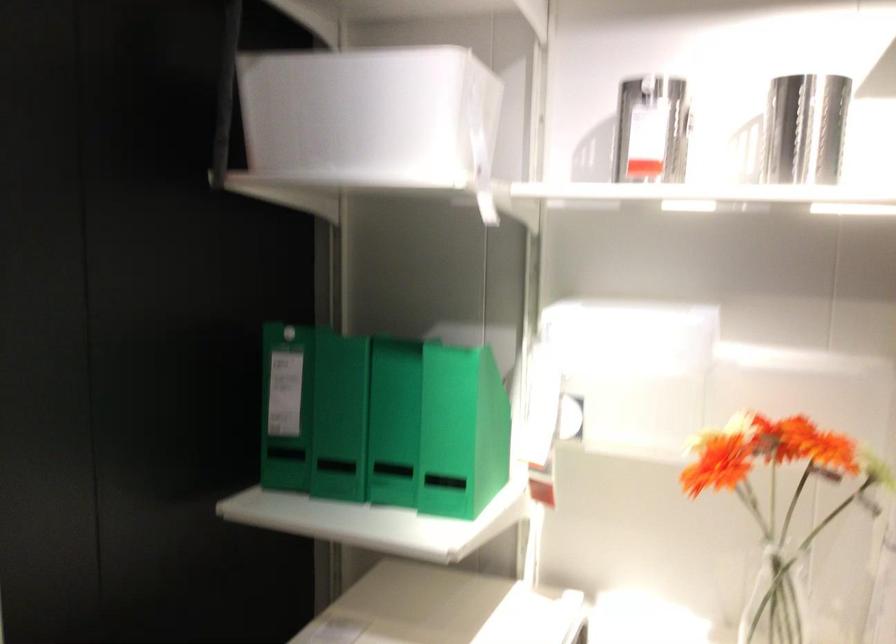
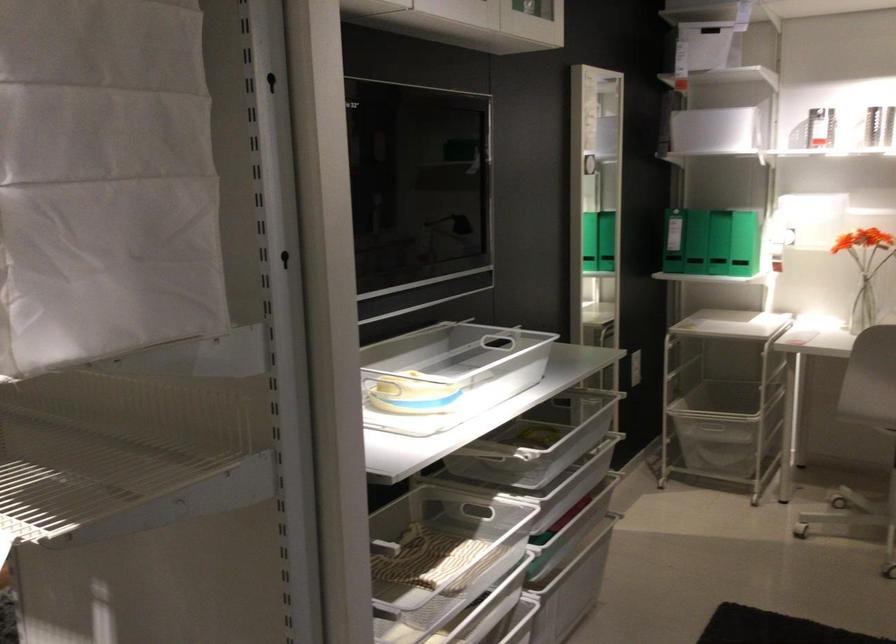
Find the pixel in the second image that matches point (283, 450) in the first image.

(695, 242)